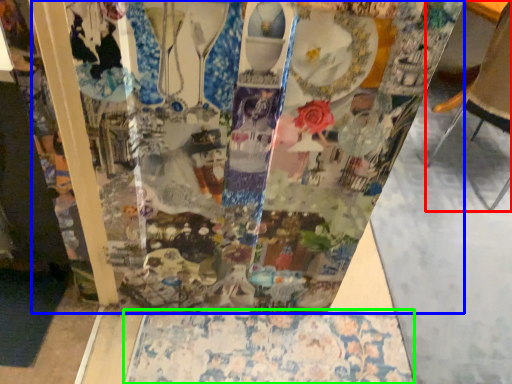
Question: Based on their relative distances, which object is nearer to furniture (highlighted by a red box)? Choose from glass box (highlighted by a blue box) and tablecloth (highlighted by a green box).

Choices:
 (A) glass box
 (B) tablecloth

Answer: (A)